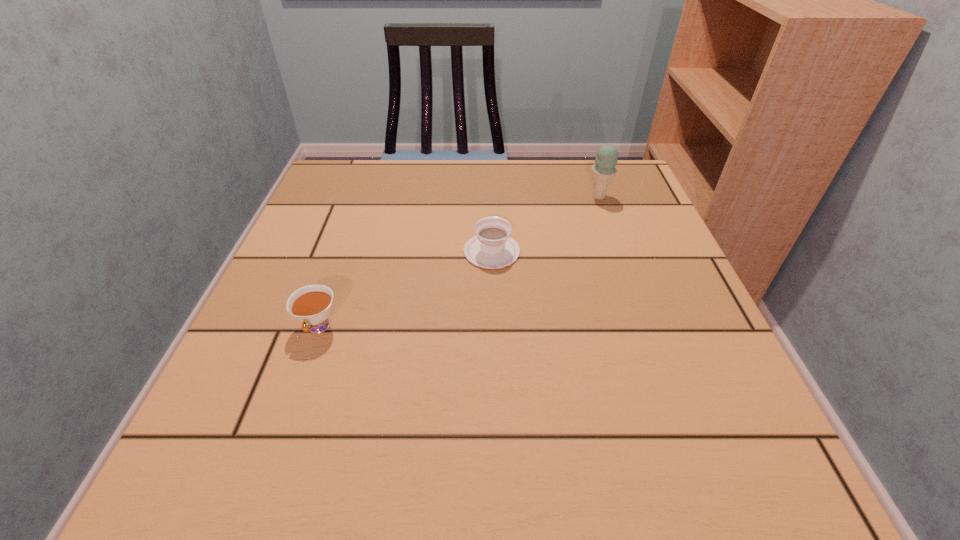
Identify the location of blank space located on the handle side of the second object from left to right. The height and width of the screenshot is (540, 960). (491, 210).

Find the location of a particular element. The image size is (960, 540). object positioned at the far edge is located at coordinates (604, 170).

Locate an element on the screen. This screenshot has width=960, height=540. object present at the left edge is located at coordinates (311, 305).

Identify the location of object positioned at the right edge. Image resolution: width=960 pixels, height=540 pixels. (604, 170).

Identify the location of object at the far right corner. (604, 170).

In the image, there is a desktop. Find the location of `vacant space at the far edge`. vacant space at the far edge is located at coordinates (428, 181).

This screenshot has width=960, height=540. In the image, there is a desktop. Identify the location of free space at the near edge. (463, 436).

The image size is (960, 540). I want to click on blank space at the left edge, so click(307, 262).

You are a GUI agent. You are given a task and a screenshot of the screen. Output one action in this format:
    pyautogui.click(x=<x>, y=<y>)
    Task: Click on the free space at the far left corner
    The height and width of the screenshot is (540, 960).
    Given the screenshot: What is the action you would take?
    pyautogui.click(x=330, y=171)

Where is `free space at the near left corner of the desktop`? free space at the near left corner of the desktop is located at coordinates (172, 493).